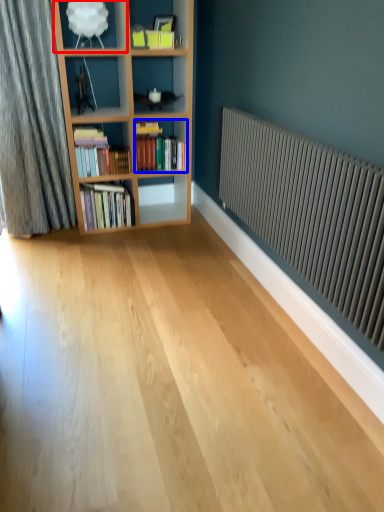
Question: Which point is further to the camera, shelf (highlighted by a red box) or book (highlighted by a blue box)?

Choices:
 (A) shelf
 (B) book

Answer: (B)